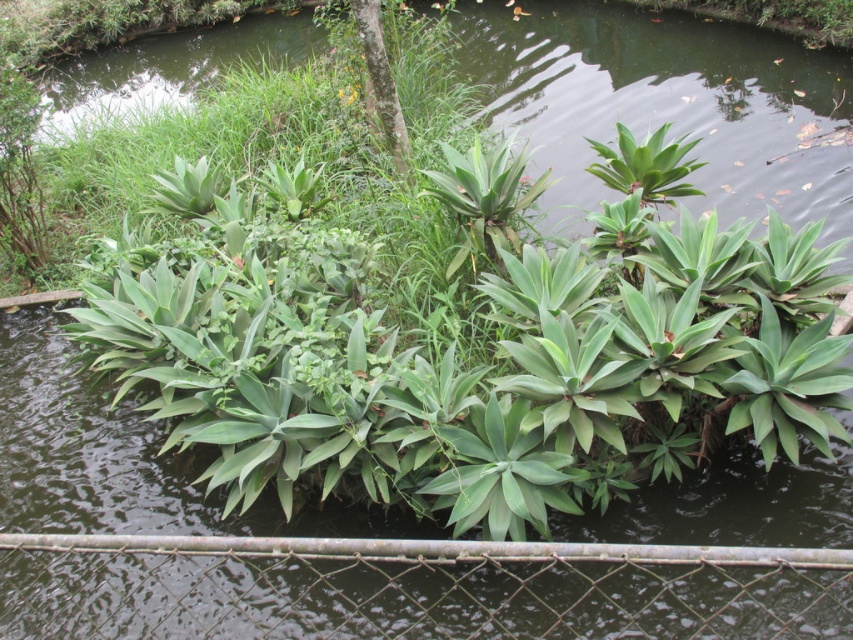
Question: Considering the real-world distances, which object is closest to the rusty metal fence at lower center?

Choices:
 (A) green leafy tree at upper center
 (B) green leafy plant at center

Answer: (B)

Question: Which point is closer to the camera?

Choices:
 (A) green leafy plant at center
 (B) rusty metal fence at lower center

Answer: (B)

Question: Can you confirm if green leafy plant at center is smaller than green leafy tree at upper center?

Choices:
 (A) no
 (B) yes

Answer: (A)

Question: Is rusty metal fence at lower center positioned at the back of green leafy tree at upper center?

Choices:
 (A) no
 (B) yes

Answer: (A)

Question: Which of the following is the farthest from the observer?

Choices:
 (A) rusty metal fence at lower center
 (B) green leafy tree at upper center
 (C) green leafy plant at center

Answer: (B)

Question: Does green leafy plant at center have a lesser width compared to green leafy tree at upper center?

Choices:
 (A) no
 (B) yes

Answer: (A)